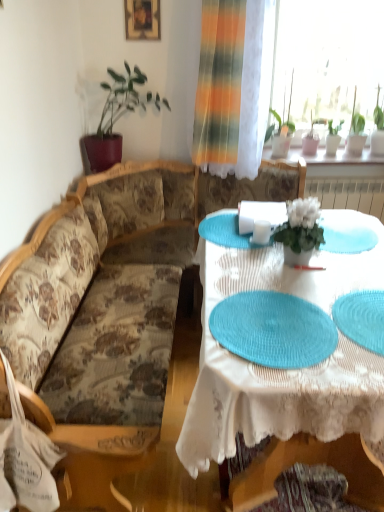
Locate an element on the screen. The height and width of the screenshot is (512, 384). free point behind teal woven placemat at center is located at coordinates (271, 274).